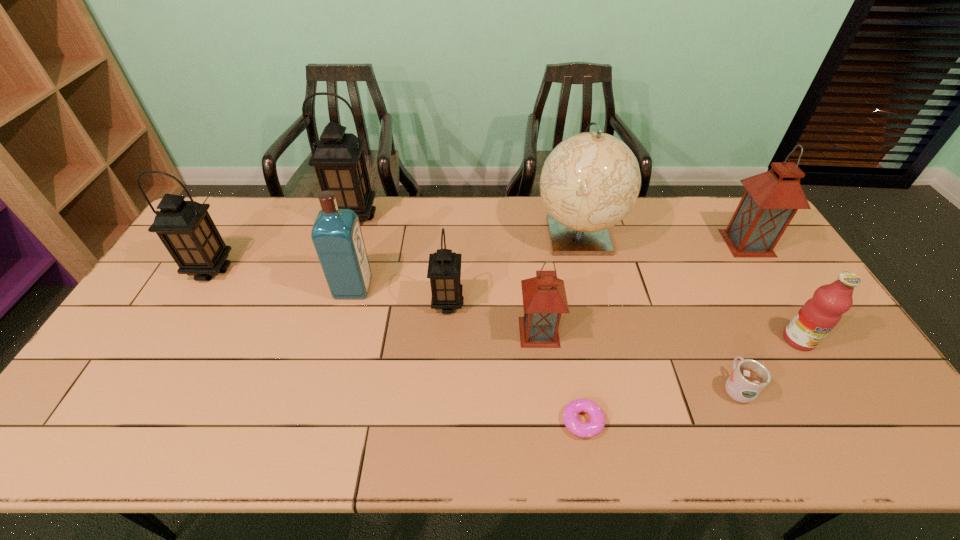
Where is `the left pink lantern`? The image size is (960, 540). the left pink lantern is located at coordinates (544, 298).

Find the location of a particular element. This screenshot has width=960, height=540. the smaller pink lantern is located at coordinates (544, 298).

I want to click on fruit juice, so click(x=820, y=314).

Find the location of a particular element. the third object from right to left is located at coordinates (749, 377).

The image size is (960, 540). Find the location of `cup`. cup is located at coordinates (749, 377).

Identify the location of doughnut. (596, 424).

Locate an element on the screen. The width and height of the screenshot is (960, 540). pink doughnut is located at coordinates (596, 424).

I want to click on free space located 0.400m on the front of the biggest black lantern, so click(321, 323).

Where is `vacant space located 0.190m on the surface of the globe showing Europe and Africa`? Image resolution: width=960 pixels, height=540 pixels. vacant space located 0.190m on the surface of the globe showing Europe and Africa is located at coordinates (597, 314).

This screenshot has height=540, width=960. I want to click on vacant space situated on the left of the right pink lantern, so click(677, 243).